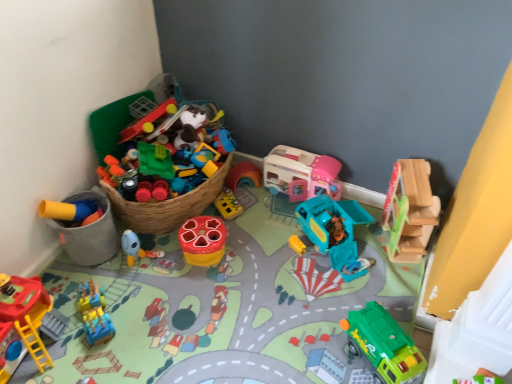
Identify the location of vacant area situated to the left side of blue rubber duck at center, which ranks as the sixth toy in right-to-left order. This screenshot has width=512, height=384. (101, 269).